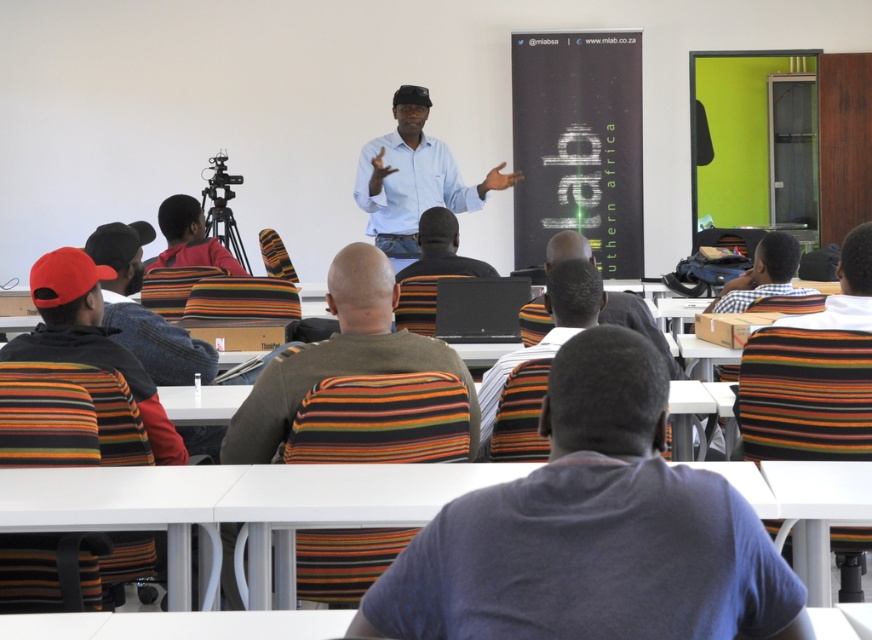
You are a photographer trying to capture a candid shot of the two individuals at the center of the classroom scene. The dark gray hoodie at center and the blue shirt at center are both facing the presenter. Since you want to ensure both subjects are fully visible in the frame, which of the two should you position closer to the camera to avoid any part of their clothing being cut off?

The dark gray hoodie at center is shorter than the blue shirt at center. To ensure both are fully visible, position the dark gray hoodie at center closer to the camera since it is shorter and less likely to be cut off compared to the taller blue shirt at center.

You are standing in the classroom and want to reach a point that is exactly 2 meters away from the camera. Is the point at coordinate point (x=578, y=432) within that distance?

The distance of point (x=578, y=432) from camera is 1.89 meters, so yes, the point at coordinate point (x=578, y=432) is within 2 meters from the camera.

You are a student in the classroom and need to borrow a pen from the person sitting next to you. The dark gray hoodie at center and the striped sweater at center are both in front of you. Can you comfortably reach them without leaving your seat?

The dark gray hoodie at center and striped sweater at center are 1.77 meters apart, so you cannot comfortably reach them without leaving your seat because the distance between them is too large.